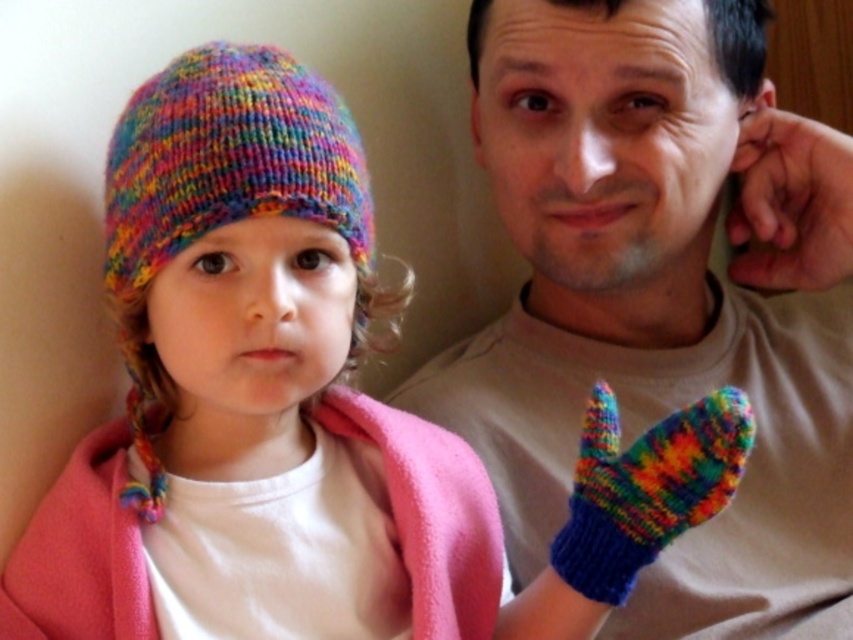
Who is more forward, (583, 236) or (556, 556)?

Point (556, 556) is more forward.

Does knitted beige shirt at center appear over multicolored knitted mitten at right?

Correct, knitted beige shirt at center is located above multicolored knitted mitten at right.

Is point (654, 49) positioned in front of point (698, 493)?

No, (654, 49) is behind (698, 493).

Image resolution: width=853 pixels, height=640 pixels. Identify the location of knitted beige shirt at center. (662, 298).

The image size is (853, 640). What do you see at coordinates (227, 157) in the screenshot? I see `multicolored knitted hat at left` at bounding box center [227, 157].

Does multicolored knitted hat at left appear over multicolored knitted mitten at right?

Correct, multicolored knitted hat at left is located above multicolored knitted mitten at right.

Locate an element on the screen. The image size is (853, 640). multicolored knitted hat at left is located at coordinates (227, 157).

The height and width of the screenshot is (640, 853). I want to click on multicolored knitted hat at left, so click(227, 157).

Can you confirm if multicolored knitted mitten at right is positioned above smooth skin hand at upper right?

Actually, multicolored knitted mitten at right is below smooth skin hand at upper right.

Does point (726, 488) come behind point (730, 262)?

No.

You are a GUI agent. You are given a task and a screenshot of the screen. Output one action in this format:
    pyautogui.click(x=<x>, y=<y>)
    Task: Click on the multicolored knitted mitten at right
    This screenshot has height=640, width=853.
    Given the screenshot: What is the action you would take?
    pyautogui.click(x=646, y=486)

Locate an element on the screen. multicolored knitted mitten at right is located at coordinates (646, 486).